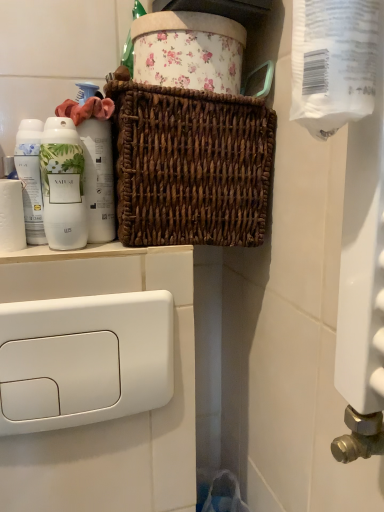
Identify the location of white glossy mouthwash at left. The width and height of the screenshot is (384, 512). (30, 178).

The width and height of the screenshot is (384, 512). Find the location of `white matte toilet paper at left, the 2th toilet paper from the front`. white matte toilet paper at left, the 2th toilet paper from the front is located at coordinates (11, 216).

Measure the distance between white matte bottle at left and camera.

white matte bottle at left is 56.83 centimeters from camera.

Identify the location of white glossy mouthwash at left. (30, 178).

Find the location of `picnic basket above the white matte bottle at left (from the image's perspective)`. picnic basket above the white matte bottle at left (from the image's perspective) is located at coordinates (190, 166).

Considering the positions of objects brown woven basket at center and white matte bottle at left in the image provided, who is more to the left, brown woven basket at center or white matte bottle at left?

From the viewer's perspective, white matte bottle at left appears more on the left side.

From a real-world perspective, is brown woven basket at center over white matte bottle at left?

Correct, in the physical world, brown woven basket at center is higher than white matte bottle at left.

Considering the points (240, 203) and (48, 169), which point is behind, point (240, 203) or point (48, 169)?

The point (240, 203) is farther.

Is brown woven basket at center far from white glossy mouthwash at left?

No, brown woven basket at center is not far away from white glossy mouthwash at left.

Do you think brown woven basket at center is within white glossy mouthwash at left, or outside of it?

brown woven basket at center is not enclosed by white glossy mouthwash at left.

Looking at this image, in the image, is brown woven basket at center positioned in front of or behind white glossy mouthwash at left?

brown woven basket at center is positioned closer to the viewer than white glossy mouthwash at left.

In order to click on picnic basket positioned vertically above the white glossy mouthwash at left (from a real-world perspective) in this screenshot , I will do `click(190, 166)`.

Considering the sizes of objects transparent plastic toilet paper at upper right, the second toilet paper ordered from the bottom, and white matte toilet paper at left, arranged as the second toilet paper when viewed from the right, in the image provided, who is smaller, transparent plastic toilet paper at upper right, the second toilet paper ordered from the bottom, or white matte toilet paper at left, arranged as the second toilet paper when viewed from the right,?

white matte toilet paper at left, arranged as the second toilet paper when viewed from the right, is smaller.

From the image's perspective, is transparent plastic toilet paper at upper right, which appears as the 2th toilet paper when viewed from the left, located above white matte toilet paper at left, arranged as the second toilet paper when viewed from the right?

Correct, transparent plastic toilet paper at upper right, which appears as the 2th toilet paper when viewed from the left, appears higher than white matte toilet paper at left, arranged as the second toilet paper when viewed from the right, in the image.

From a real-world perspective, is transparent plastic toilet paper at upper right, which is the first toilet paper from front to back, below white matte toilet paper at left, positioned as the second toilet paper in top-to-bottom order?

Incorrect, from a real-world perspective, transparent plastic toilet paper at upper right, which is the first toilet paper from front to back, is higher than white matte toilet paper at left, positioned as the second toilet paper in top-to-bottom order.

Which object is further away from the camera, transparent plastic toilet paper at upper right, which is the first toilet paper from front to back, or white matte toilet paper at left, placed as the first toilet paper when sorted from left to right?

white matte toilet paper at left, placed as the first toilet paper when sorted from left to right, is behind.

From the picture: Can you tell me how much white matte bottle at left and white glossy mouthwash at left differ in facing direction?

0.00668 degrees.

From the image's perspective, which one is positioned higher, white matte bottle at left or white glossy mouthwash at left?

white glossy mouthwash at left.

Considering their positions, is white matte bottle at left located in front of or behind white glossy mouthwash at left?

Visually, white matte bottle at left is located in front of white glossy mouthwash at left.

Is white matte bottle at left aimed at white glossy mouthwash at left?

No, white matte bottle at left is not oriented towards white glossy mouthwash at left.

Considering the relative sizes of white matte toilet paper at left, placed as the first toilet paper when sorted from left to right, and white glossy mouthwash at left in the image provided, is white matte toilet paper at left, placed as the first toilet paper when sorted from left to right, taller than white glossy mouthwash at left?

No.

Which is behind, point (11, 225) or point (44, 237)?

The point (44, 237) is behind.

From the image's perspective, is white matte toilet paper at left, placed as the first toilet paper when sorted from left to right, under white glossy mouthwash at left?

Yes, from the image's perspective, white matte toilet paper at left, placed as the first toilet paper when sorted from left to right, is beneath white glossy mouthwash at left.

Can you tell me how much white matte toilet paper at left, the 2th toilet paper from the front, and white glossy mouthwash at left differ in facing direction?

white matte toilet paper at left, the 2th toilet paper from the front, and white glossy mouthwash at left are facing 0.00518 degrees away from each other.

Considering the relative positions of brown woven basket at center and white glossy bottle at left in the image provided, is brown woven basket at center to the right of white glossy bottle at left from the viewer's perspective?

Indeed, brown woven basket at center is positioned on the right side of white glossy bottle at left.

Considering the sizes of brown woven basket at center and white glossy bottle at left in the image, is brown woven basket at center wider or thinner than white glossy bottle at left?

Considering their sizes, brown woven basket at center looks broader than white glossy bottle at left.

Relative to white glossy bottle at left, is brown woven basket at center in front or behind?

brown woven basket at center is positioned closer to the viewer than white glossy bottle at left.

How different are the orientations of brown woven basket at center and white glossy bottle at left in degrees?

They differ by 0.000945 degrees in their facing directions.

Considering the relative positions of white glossy bottle at left and transparent plastic toilet paper at upper right, placed as the first toilet paper when sorted from right to left, in the image provided, is white glossy bottle at left to the left of transparent plastic toilet paper at upper right, placed as the first toilet paper when sorted from right to left, from the viewer's perspective?

Yes, white glossy bottle at left is to the left of transparent plastic toilet paper at upper right, placed as the first toilet paper when sorted from right to left.

Is white glossy bottle at left taller than transparent plastic toilet paper at upper right, which appears as the 2th toilet paper when viewed from the left?

In fact, white glossy bottle at left may be shorter than transparent plastic toilet paper at upper right, which appears as the 2th toilet paper when viewed from the left.

Which object is further away from the camera, white glossy bottle at left or transparent plastic toilet paper at upper right, the second toilet paper ordered from the bottom?

white glossy bottle at left is further away from the camera.

Where is `picnic basket located above the white matte bottle at left (from the image's perspective)`? picnic basket located above the white matte bottle at left (from the image's perspective) is located at coordinates (190, 166).

Locate an element on the screen. mouthwash below the brown woven basket at center (from the image's perspective) is located at coordinates point(30,178).

Which object lies nearer to the anchor point white matte bottle at left, transparent plastic toilet paper at upper right, which ranks as the 1th toilet paper in top-to-bottom order, or white glossy mouthwash at left?

white glossy mouthwash at left is positioned closer to the anchor white matte bottle at left.

Based on their spatial positions, is brown woven basket at center or white matte toilet paper at left, arranged as the second toilet paper when viewed from the right, closer to white glossy mouthwash at left?

white matte toilet paper at left, arranged as the second toilet paper when viewed from the right, is positioned closer to the anchor white glossy mouthwash at left.

Looking at the image, which one is located further to white glossy mouthwash at left, white matte toilet paper at left, the first toilet paper in the bottom-to-top sequence, or white glossy bottle at left?

Among the two, white glossy bottle at left is located further to white glossy mouthwash at left.

Considering their positions, is white matte bottle at left positioned further to brown woven basket at center than white matte toilet paper at left, arranged as the second toilet paper when viewed from the right?

white matte toilet paper at left, arranged as the second toilet paper when viewed from the right.

From the image, which object appears to be nearer to white matte toilet paper at left, arranged as the second toilet paper when viewed from the right, transparent plastic toilet paper at upper right, which ranks as the 2th toilet paper in back-to-front order, or white glossy bottle at left?

Based on the image, white glossy bottle at left appears to be nearer to white matte toilet paper at left, arranged as the second toilet paper when viewed from the right.

Estimate the real-world distances between objects in this image. Which object is closer to white glossy bottle at left, white matte bottle at left or white glossy mouthwash at left?

Among the two, white matte bottle at left is located nearer to white glossy bottle at left.

When comparing their distances from white glossy bottle at left, does brown woven basket at center or white glossy mouthwash at left seem further?

Based on the image, brown woven basket at center appears to be further to white glossy bottle at left.

When comparing their distances from white glossy mouthwash at left, does white matte bottle at left or white matte toilet paper at left, the 2th toilet paper from the front, seem closer?

white matte toilet paper at left, the 2th toilet paper from the front, is positioned closer to the anchor white glossy mouthwash at left.

At what (x,y) coordinates should I click in order to perform the action: click on bottle between transparent plastic toilet paper at upper right, which ranks as the 1th toilet paper in top-to-bottom order, and white glossy bottle at left from front to back. Please return your answer as a coordinate pair (x, y). The image size is (384, 512). Looking at the image, I should click on (63, 185).

In order to click on mouthwash situated between white matte toilet paper at left, placed as the first toilet paper when sorted from left to right, and transparent plastic toilet paper at upper right, which appears as the 2th toilet paper when viewed from the left, from left to right in this screenshot , I will do `click(30, 178)`.

At what (x,y) coordinates should I click in order to perform the action: click on mouthwash between white matte toilet paper at left, the 2th toilet paper from the front, and brown woven basket at center. Please return your answer as a coordinate pair (x, y). Looking at the image, I should click on (30, 178).

Locate an element on the screen. Image resolution: width=384 pixels, height=512 pixels. toilet paper between transparent plastic toilet paper at upper right, which appears as the 2th toilet paper when viewed from the left, and white glossy bottle at left from front to back is located at coordinates (11, 216).